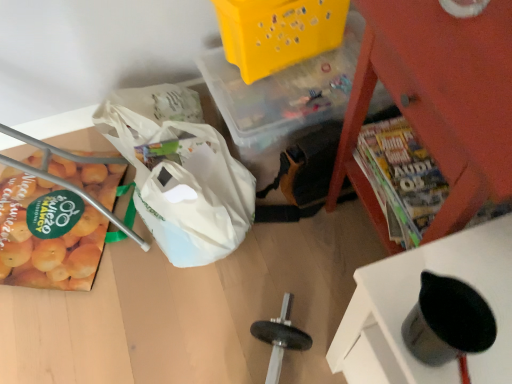
At what (x,y) coordinates should I click in order to perform the action: click on vacant area in front of yellow matte oranges at left. Please return your answer as a coordinate pair (x, y). This screenshot has height=384, width=512. Looking at the image, I should click on (83, 335).